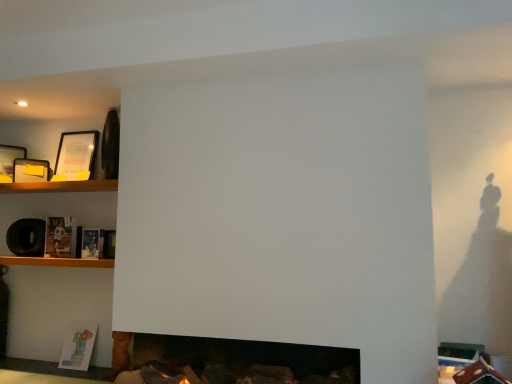
What do you see at coordinates (75, 156) in the screenshot? I see `matte black picture frame at upper left, marked as the first picture frame in a right-to-left arrangement` at bounding box center [75, 156].

Consider the image. In order to face wooden shelf at lower left, which ranks as the first shelf in bottom-to-top order, should I rotate leftwards or rightwards?

To face it directly, rotate left by 24.488 degrees.

What do you see at coordinates (97, 243) in the screenshot? I see `hardcover book at center-left, which appears as the 2th book when viewed from the top` at bounding box center [97, 243].

Identify the location of matte black picture frame at left, which is counted as the second picture frame, starting from the left. Image resolution: width=512 pixels, height=384 pixels. (30, 170).

This screenshot has height=384, width=512. I want to click on matte black picture frame at upper left, the third picture frame positioned from the left, so click(75, 156).

Which of these two, wooden shelf at lower left, which is the 2th shelf from top to bottom, or matte paper book at lower left, which is counted as the first book, starting from the bottom, stands shorter?

Standing shorter between the two is wooden shelf at lower left, which is the 2th shelf from top to bottom.

Between wooden shelf at lower left, which ranks as the first shelf in bottom-to-top order, and matte paper book at lower left, which ranks as the third book in top-to-bottom order, which one has larger size?

wooden shelf at lower left, which ranks as the first shelf in bottom-to-top order.

The width and height of the screenshot is (512, 384). I want to click on the 1st shelf above the matte paper book at lower left, which is counted as the first book, starting from the bottom (from the image's perspective), so click(x=57, y=262).

How different are the orientations of wooden shelf at lower left, which ranks as the first shelf in bottom-to-top order, and matte paper book at lower left, which is counted as the first book, starting from the bottom, in degrees?

wooden shelf at lower left, which ranks as the first shelf in bottom-to-top order, and matte paper book at lower left, which is counted as the first book, starting from the bottom, are facing 4.19 degrees away from each other.

From the image's perspective, does matte black picture frame at upper left, the third picture frame positioned from the left, appear lower than matte black picture frame at left, the 2th picture frame from the right?

Actually, matte black picture frame at upper left, the third picture frame positioned from the left, appears above matte black picture frame at left, the 2th picture frame from the right, in the image.

At what (x,y) coordinates should I click in order to perform the action: click on picture frame that appears behind the matte black picture frame at upper left, the third picture frame positioned from the left. Please return your answer as a coordinate pair (x, y). Looking at the image, I should click on (30, 170).

From a real-world perspective, between matte black picture frame at upper left, the third picture frame positioned from the left, and matte black picture frame at left, which is counted as the second picture frame, starting from the left, who is vertically higher?

matte black picture frame at upper left, the third picture frame positioned from the left, from a real-world perspective.

Can you confirm if wooden shelf at lower left, which is the 2th shelf from top to bottom, is smaller than matte black picture frame at upper left, arranged as the 1th picture frame when viewed from the left?

Actually, wooden shelf at lower left, which is the 2th shelf from top to bottom, might be larger than matte black picture frame at upper left, arranged as the 1th picture frame when viewed from the left.

Can you see wooden shelf at lower left, which ranks as the first shelf in bottom-to-top order, touching matte black picture frame at upper left, arranged as the 1th picture frame when viewed from the left?

No.

From the image's perspective, is wooden shelf at lower left, which ranks as the first shelf in bottom-to-top order, above or below matte black picture frame at upper left, positioned as the 3th picture frame in right-to-left order?

From the image's perspective, wooden shelf at lower left, which ranks as the first shelf in bottom-to-top order, appears below matte black picture frame at upper left, positioned as the 3th picture frame in right-to-left order.

Does wooden shelf at lower left, which is the 2th shelf from top to bottom, turn towards matte black picture frame at upper left, positioned as the 3th picture frame in right-to-left order?

No, wooden shelf at lower left, which is the 2th shelf from top to bottom, is not aimed at matte black picture frame at upper left, positioned as the 3th picture frame in right-to-left order.

From the picture: Would you say matte paper book at left, positioned as the 3th book in bottom-to-top order, is outside wooden shelf at lower left, which is the 2th shelf from top to bottom?

Absolutely, matte paper book at left, positioned as the 3th book in bottom-to-top order, is external to wooden shelf at lower left, which is the 2th shelf from top to bottom.

Could you measure the distance between matte paper book at left, which is the first book in top-to-bottom order, and wooden shelf at lower left, which is the 2th shelf from top to bottom?

The distance of matte paper book at left, which is the first book in top-to-bottom order, from wooden shelf at lower left, which is the 2th shelf from top to bottom, is 6.28 inches.

The width and height of the screenshot is (512, 384). Find the location of `the 2nd book above the wooden shelf at lower left, which is the 2th shelf from top to bottom (from the image's perspective)`. the 2nd book above the wooden shelf at lower left, which is the 2th shelf from top to bottom (from the image's perspective) is located at coordinates (60, 237).

Does matte paper book at left, positioned as the 3th book in bottom-to-top order, touch wooden shelf at lower left, which is the 2th shelf from top to bottom?

No, matte paper book at left, positioned as the 3th book in bottom-to-top order, is not next to wooden shelf at lower left, which is the 2th shelf from top to bottom.

Based on the photo, how far apart are matte paper book at lower left, which is counted as the first book, starting from the bottom, and matte black picture frame at upper left, arranged as the 1th picture frame when viewed from the left?

matte paper book at lower left, which is counted as the first book, starting from the bottom, is 4.25 feet away from matte black picture frame at upper left, arranged as the 1th picture frame when viewed from the left.

Considering the relative positions of matte paper book at lower left, which ranks as the third book in top-to-bottom order, and matte black picture frame at upper left, positioned as the 3th picture frame in right-to-left order, in the image provided, is matte paper book at lower left, which ranks as the third book in top-to-bottom order, to the left or to the right of matte black picture frame at upper left, positioned as the 3th picture frame in right-to-left order,?

Clearly, matte paper book at lower left, which ranks as the third book in top-to-bottom order, is on the right of matte black picture frame at upper left, positioned as the 3th picture frame in right-to-left order, in the image.

Is matte paper book at lower left, which is counted as the first book, starting from the bottom, wider than matte black picture frame at upper left, arranged as the 1th picture frame when viewed from the left?

Correct, the width of matte paper book at lower left, which is counted as the first book, starting from the bottom, exceeds that of matte black picture frame at upper left, arranged as the 1th picture frame when viewed from the left.

From the image's perspective, which one is positioned lower, matte paper book at lower left, which ranks as the third book in top-to-bottom order, or matte black picture frame at upper left, arranged as the 1th picture frame when viewed from the left?

From the image's view, matte paper book at lower left, which ranks as the third book in top-to-bottom order, is below.

Is wooden shelf at left, which is counted as the second shelf, starting from the bottom, touching wooden shelf at lower left, which is the 2th shelf from top to bottom?

wooden shelf at left, which is counted as the second shelf, starting from the bottom, and wooden shelf at lower left, which is the 2th shelf from top to bottom, are clearly separated.

From a real-world perspective, who is located higher, wooden shelf at left, which is counted as the second shelf, starting from the bottom, or wooden shelf at lower left, which is the 2th shelf from top to bottom?

From a 3D spatial view, wooden shelf at left, which is counted as the second shelf, starting from the bottom, is above.

Does point (14, 185) lie in front of point (71, 261)?

Yes, it is in front of point (71, 261).

Which object is closer to the camera taking this photo, wooden shelf at left, which is counted as the second shelf, starting from the bottom, or wooden shelf at lower left, which ranks as the first shelf in bottom-to-top order?

wooden shelf at lower left, which ranks as the first shelf in bottom-to-top order, is in front.

How many degrees apart are the facing directions of hardcover book at center-left, which is the 2th book in bottom-to-top order, and matte black picture frame at upper left, positioned as the 3th picture frame in right-to-left order?

The angular difference between hardcover book at center-left, which is the 2th book in bottom-to-top order, and matte black picture frame at upper left, positioned as the 3th picture frame in right-to-left order, is 63.3 degrees.

Is hardcover book at center-left, which appears as the 2th book when viewed from the top, bigger than matte black picture frame at upper left, arranged as the 1th picture frame when viewed from the left?

No, hardcover book at center-left, which appears as the 2th book when viewed from the top, is not bigger than matte black picture frame at upper left, arranged as the 1th picture frame when viewed from the left.

Which object is closer to the camera, hardcover book at center-left, which is the 2th book in bottom-to-top order, or matte black picture frame at upper left, positioned as the 3th picture frame in right-to-left order?

hardcover book at center-left, which is the 2th book in bottom-to-top order.

Considering the points (109, 255) and (2, 163), which point is in front, point (109, 255) or point (2, 163)?

The point (109, 255) is closer.

Where is `the 3rd book behind the wooden shelf at lower left, which ranks as the first shelf in bottom-to-top order`? This screenshot has height=384, width=512. the 3rd book behind the wooden shelf at lower left, which ranks as the first shelf in bottom-to-top order is located at coordinates pyautogui.click(x=78, y=345).

Find the location of a particular element. the 2nd picture frame below the matte black picture frame at upper left, marked as the first picture frame in a right-to-left arrangement (from the image's perspective) is located at coordinates (30, 170).

From the image, which object appears to be nearer to wooden shelf at lower left, which ranks as the first shelf in bottom-to-top order, matte black picture frame at upper left, positioned as the 3th picture frame in right-to-left order, or matte black picture frame at upper left, the third picture frame positioned from the left?

Based on the image, matte black picture frame at upper left, positioned as the 3th picture frame in right-to-left order, appears to be nearer to wooden shelf at lower left, which ranks as the first shelf in bottom-to-top order.

When comparing their distances from matte paper book at left, positioned as the 3th book in bottom-to-top order, does wooden shelf at lower left, which is the 2th shelf from top to bottom, or matte paper book at lower left, which is counted as the first book, starting from the bottom, seem further?

matte paper book at lower left, which is counted as the first book, starting from the bottom, lies further to matte paper book at left, positioned as the 3th book in bottom-to-top order, than the other object.

Which object lies further to the anchor point matte paper book at lower left, which ranks as the third book in top-to-bottom order, hardcover book at center-left, which is the 2th book in bottom-to-top order, or wooden shelf at lower left, which is the 2th shelf from top to bottom?

hardcover book at center-left, which is the 2th book in bottom-to-top order, lies further to matte paper book at lower left, which ranks as the third book in top-to-bottom order, than the other object.

Considering their positions, is wooden shelf at left, which ranks as the first shelf in top-to-bottom order, positioned closer to hardcover book at center-left, which is the 2th book in bottom-to-top order, than matte black picture frame at upper left, marked as the first picture frame in a right-to-left arrangement?

wooden shelf at left, which ranks as the first shelf in top-to-bottom order.

Considering their positions, is matte paper book at lower left, which ranks as the third book in top-to-bottom order, positioned further to matte black picture frame at upper left, arranged as the 1th picture frame when viewed from the left, than matte black picture frame at upper left, marked as the first picture frame in a right-to-left arrangement?

matte paper book at lower left, which ranks as the third book in top-to-bottom order.

When comparing their distances from hardcover book at center-left, which is the 2th book in bottom-to-top order, does wooden shelf at left, which ranks as the first shelf in top-to-bottom order, or matte black picture frame at upper left, positioned as the 3th picture frame in right-to-left order, seem further?

matte black picture frame at upper left, positioned as the 3th picture frame in right-to-left order.

From the image, which object appears to be farther from wooden shelf at left, which is counted as the second shelf, starting from the bottom, matte black picture frame at upper left, arranged as the 1th picture frame when viewed from the left, or matte paper book at left, positioned as the 3th book in bottom-to-top order?

Among the two, matte paper book at left, positioned as the 3th book in bottom-to-top order, is located further to wooden shelf at left, which is counted as the second shelf, starting from the bottom.

Based on their spatial positions, is matte paper book at lower left, which ranks as the third book in top-to-bottom order, or matte black picture frame at left, the 2th picture frame from the right, further from matte paper book at left, positioned as the 3th book in bottom-to-top order?

The object further to matte paper book at left, positioned as the 3th book in bottom-to-top order, is matte paper book at lower left, which ranks as the third book in top-to-bottom order.

This screenshot has height=384, width=512. Find the location of `shelf between matte black picture frame at upper left, the third picture frame positioned from the left, and matte paper book at left, positioned as the 3th book in bottom-to-top order, from top to bottom`. shelf between matte black picture frame at upper left, the third picture frame positioned from the left, and matte paper book at left, positioned as the 3th book in bottom-to-top order, from top to bottom is located at coordinates (60, 186).

Locate an element on the screen. This screenshot has height=384, width=512. shelf between matte black picture frame at left, the 2th picture frame from the right, and matte paper book at left, which is the first book in top-to-bottom order, in the up-down direction is located at coordinates (60, 186).

The width and height of the screenshot is (512, 384). In order to click on book between matte paper book at left, positioned as the 3th book in bottom-to-top order, and matte paper book at lower left, which ranks as the third book in top-to-bottom order, vertically in this screenshot , I will do `click(97, 243)`.

Identify the location of picture frame that lies between matte black picture frame at upper left, arranged as the 1th picture frame when viewed from the left, and matte paper book at lower left, which ranks as the third book in top-to-bottom order, from top to bottom. The width and height of the screenshot is (512, 384). (30, 170).